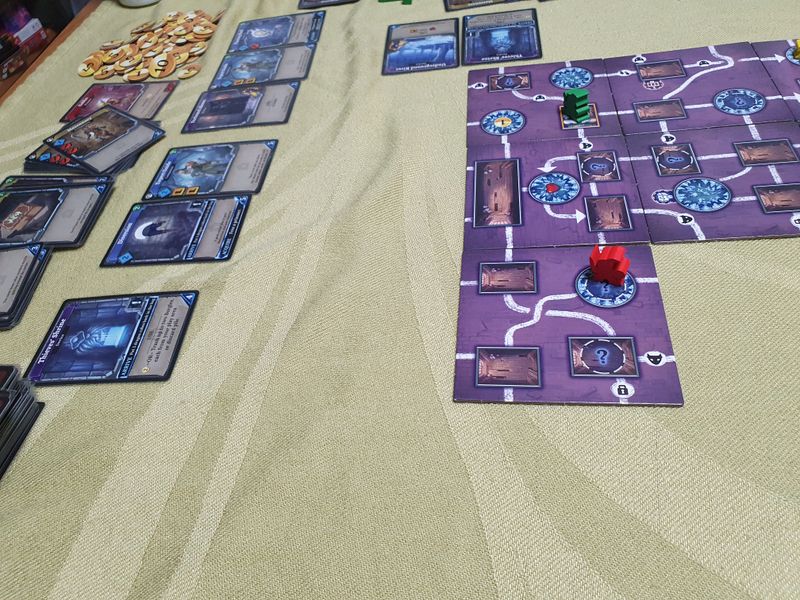
Find the location of a particular element. light tan strip on blanket is located at coordinates (154, 423).